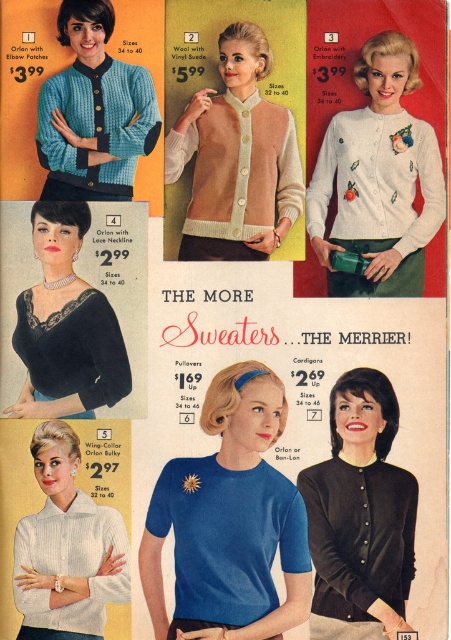
Between black matte cardigan at center and white knit sweater at lower left, which one appears on the left side from the viewer's perspective?

white knit sweater at lower left is more to the left.

Is black matte cardigan at center in front of white knit sweater at lower left?

No, it is behind white knit sweater at lower left.

Which is behind, point (316, 509) or point (37, 604)?

The point (316, 509) is behind.

The width and height of the screenshot is (451, 640). I want to click on black matte cardigan at center, so click(359, 515).

Does matte blue knit sweater at center have a greater width compared to white embroidered cardigan at upper right?

Yes, matte blue knit sweater at center is wider than white embroidered cardigan at upper right.

Between matte blue knit sweater at center and white embroidered cardigan at upper right, which one is positioned lower?

Positioned lower is matte blue knit sweater at center.

Image resolution: width=451 pixels, height=640 pixels. In order to click on matte blue knit sweater at center in this screenshot , I will do `click(230, 520)`.

Which is below, white embroidered cardigan at upper right or white knit sweater at lower left?

white knit sweater at lower left

Which is above, white embroidered cardigan at upper right or white knit sweater at lower left?

white embroidered cardigan at upper right is above.

Does point (385, 202) come farther from viewer compared to point (97, 637)?

Yes, point (385, 202) is behind point (97, 637).

Locate an element on the screen. The width and height of the screenshot is (451, 640). white embroidered cardigan at upper right is located at coordinates (377, 179).